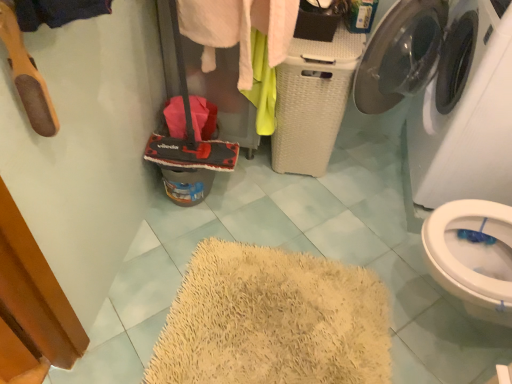
Question: Considering the relative sizes of soft pink towel at center and white glossy washing machine at upper right in the image provided, is soft pink towel at center smaller than white glossy washing machine at upper right?

Choices:
 (A) yes
 (B) no

Answer: (A)

Question: Considering the relative positions of soft pink towel at center and white glossy washing machine at upper right in the image provided, is soft pink towel at center to the left of white glossy washing machine at upper right from the viewer's perspective?

Choices:
 (A) no
 (B) yes

Answer: (B)

Question: Is soft pink towel at center facing away from white glossy washing machine at upper right?

Choices:
 (A) no
 (B) yes

Answer: (A)

Question: Is soft pink towel at center completely or partially outside of white glossy washing machine at upper right?

Choices:
 (A) no
 (B) yes

Answer: (B)

Question: Can you confirm if soft pink towel at center is positioned to the right of white glossy washing machine at upper right?

Choices:
 (A) no
 (B) yes

Answer: (A)

Question: Does soft pink towel at center turn towards white glossy washing machine at upper right?

Choices:
 (A) no
 (B) yes

Answer: (A)

Question: Can you confirm if white glossy washing machine at upper right is taller than red fabric mop at center-left?

Choices:
 (A) yes
 (B) no

Answer: (A)

Question: Is white glossy washing machine at upper right bigger than red fabric mop at center-left?

Choices:
 (A) no
 (B) yes

Answer: (B)

Question: Is white glossy washing machine at upper right at the right side of red fabric mop at center-left?

Choices:
 (A) no
 (B) yes

Answer: (B)

Question: From the image's perspective, is white glossy washing machine at upper right on red fabric mop at center-left?

Choices:
 (A) no
 (B) yes

Answer: (A)

Question: Would you say white glossy washing machine at upper right is outside red fabric mop at center-left?

Choices:
 (A) yes
 (B) no

Answer: (A)

Question: Can you confirm if white glossy washing machine at upper right is wider than red fabric mop at center-left?

Choices:
 (A) yes
 (B) no

Answer: (A)

Question: Is soft pink towel at center shorter than red fabric mop at center-left?

Choices:
 (A) no
 (B) yes

Answer: (A)